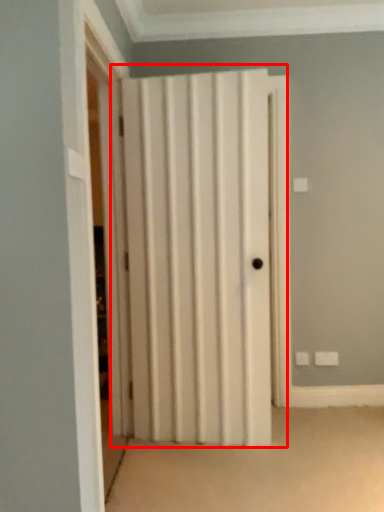
Question: From the image's perspective, what is the correct spatial positioning of door (annotated by the red box) in reference to screen door?

Choices:
 (A) below
 (B) above

Answer: (A)